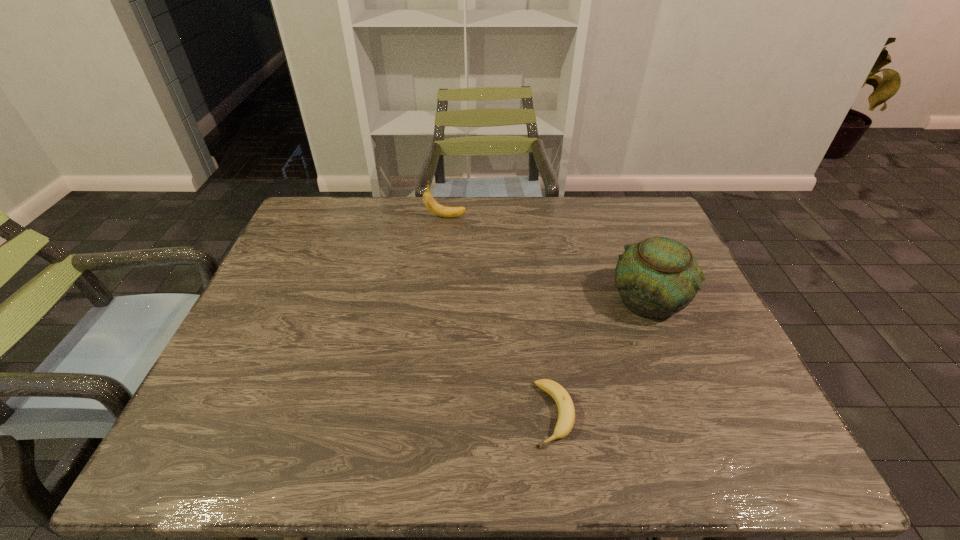
Identify the location of empty location between the nearest object and the left banana. The height and width of the screenshot is (540, 960). (499, 315).

Find the location of a particular element. vacant space that is in between the nearer banana and the second nearest object is located at coordinates (601, 357).

Locate an element on the screen. The width and height of the screenshot is (960, 540). vacant area that lies between the second farthest object and the leftmost object is located at coordinates (547, 258).

Where is `vacant space that's between the rightmost object and the farther banana`? vacant space that's between the rightmost object and the farther banana is located at coordinates (547, 258).

You are a GUI agent. You are given a task and a screenshot of the screen. Output one action in this format:
    pyautogui.click(x=<x>, y=<y>)
    Task: Click on the vacant area between the rightmost object and the nearer banana
    
    Given the screenshot: What is the action you would take?
    pyautogui.click(x=601, y=357)

You are a GUI agent. You are given a task and a screenshot of the screen. Output one action in this format:
    pyautogui.click(x=<x>, y=<y>)
    Task: Click on the closest object to the leftmost object
    The height and width of the screenshot is (540, 960).
    Given the screenshot: What is the action you would take?
    pyautogui.click(x=658, y=277)

Find the location of a particular element. The height and width of the screenshot is (540, 960). object that is the closest to the nearer banana is located at coordinates (658, 277).

This screenshot has width=960, height=540. In order to click on vacant area in the image that satisfies the following two spatial constraints: 1. on the back side of the second farthest object; 2. at the start of the peel on the farther banana in this screenshot , I will do tap(615, 217).

The height and width of the screenshot is (540, 960). I want to click on vacant position in the image that satisfies the following two spatial constraints: 1. at the start of the peel on the farthest object; 2. on the left side of the tallest object, so click(x=438, y=300).

The height and width of the screenshot is (540, 960). Identify the location of free space that satisfies the following two spatial constraints: 1. at the start of the peel on the pottery; 2. on the right side of the farthest object. (438, 300).